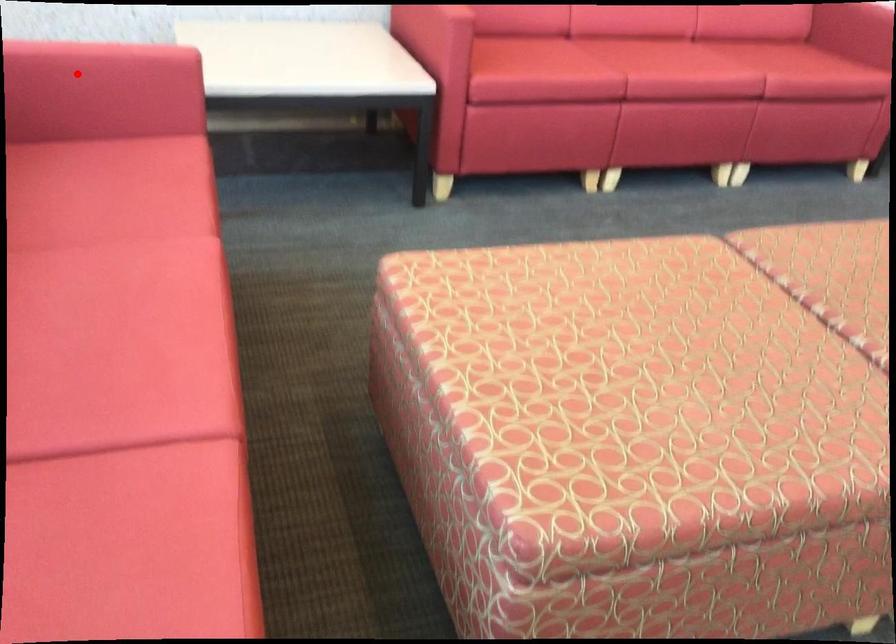
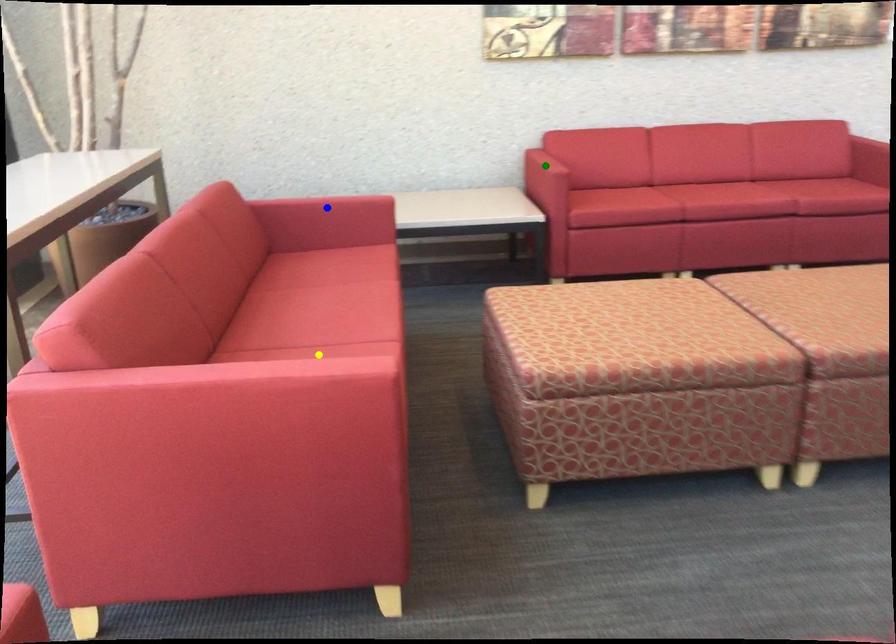
Question: I am providing you with two images of the same scene from different viewpoints. A red point is marked on the first image. You are given multiple points on the second image. Which point in image 2 represents the same 3d spot as the red point in image 1?

Choices:
 (A) blue point
 (B) green point
 (C) yellow point

Answer: (A)